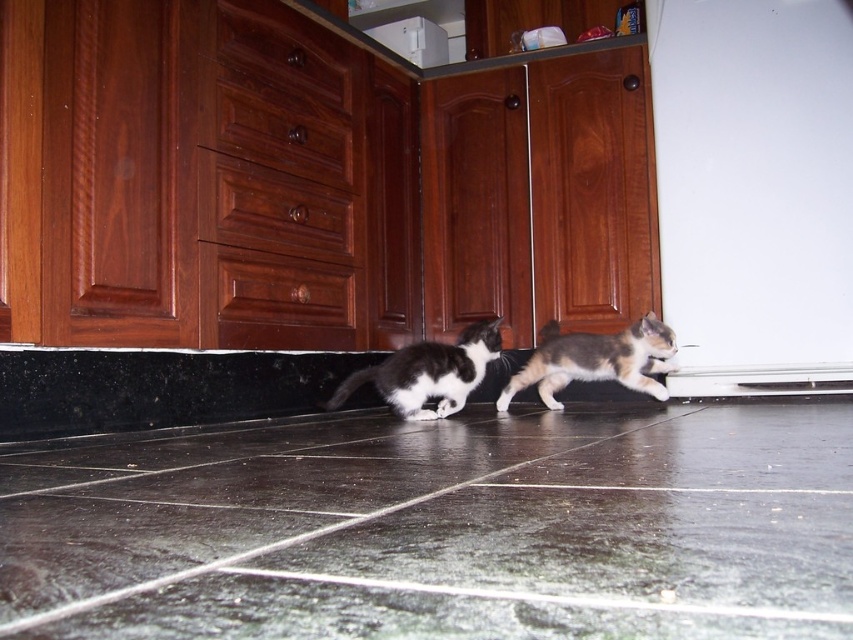
Question: Is calico fur cat at center positioned in front of black and white fur cat at center?

Choices:
 (A) yes
 (B) no

Answer: (B)

Question: Does black tile floor at lower center appear under black and white fur cat at center?

Choices:
 (A) yes
 (B) no

Answer: (A)

Question: Which object is closer to the camera taking this photo?

Choices:
 (A) black and white fur cat at center
 (B) calico fur cat at center
 (C) black tile floor at lower center

Answer: (C)

Question: Which object is farther from the camera taking this photo?

Choices:
 (A) black and white fur cat at center
 (B) calico fur cat at center
 (C) black tile floor at lower center

Answer: (B)

Question: Which point is closer to the camera?

Choices:
 (A) (483, 330)
 (B) (666, 394)
 (C) (370, 456)

Answer: (C)

Question: Considering the relative positions of black tile floor at lower center and black and white fur cat at center in the image provided, where is black tile floor at lower center located with respect to black and white fur cat at center?

Choices:
 (A) right
 (B) left

Answer: (A)